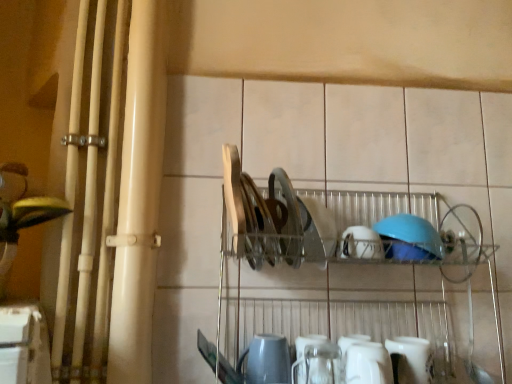
This screenshot has width=512, height=384. Describe the element at coordinates (410, 359) in the screenshot. I see `white glossy mug at lower center, which is the fourth tableware from top to bottom` at that location.

The image size is (512, 384). What do you see at coordinates (368, 364) in the screenshot? I see `white glossy mug at lower center, which is counted as the third tableware, starting from the bottom` at bounding box center [368, 364].

Where is `matte gray kettle at lower center, the third tableware positioned from the top`? Image resolution: width=512 pixels, height=384 pixels. matte gray kettle at lower center, the third tableware positioned from the top is located at coordinates (267, 360).

Is point (411, 381) closer to viewer compared to point (343, 255)?

Yes, it is in front of point (343, 255).

Is white glossy mug at lower center, the 1th tableware viewed from the right, shorter than white matte bowl at center, the 3th tableware viewed from the left?

No, white glossy mug at lower center, the 1th tableware viewed from the right, is not shorter than white matte bowl at center, the 3th tableware viewed from the left.

Considering the relative sizes of white glossy mug at lower center, the 1th tableware viewed from the right, and white matte bowl at center, acting as the 4th tableware starting from the bottom, in the image provided, is white glossy mug at lower center, the 1th tableware viewed from the right, smaller than white matte bowl at center, acting as the 4th tableware starting from the bottom,?

Answer: Actually, white glossy mug at lower center, the 1th tableware viewed from the right, might be larger than white matte bowl at center, acting as the 4th tableware starting from the bottom.

From a real-world perspective, between white glossy mug at lower center, which is the fourth tableware from left to right, and white matte bowl at center, acting as the 4th tableware starting from the bottom, who is vertically higher?

From a 3D spatial view, white matte bowl at center, acting as the 4th tableware starting from the bottom, is above.

From the image's perspective, which is below, metallic silver dish rack at center or white glossy mug at lower center, which is the second tableware in left-to-right order?

white glossy mug at lower center, which is the second tableware in left-to-right order.

Looking at their sizes, would you say metallic silver dish rack at center is wider or thinner than white glossy mug at lower center, the second tableware positioned from the top?

metallic silver dish rack at center is wider than white glossy mug at lower center, the second tableware positioned from the top.

Considering the positions of point (246, 195) and point (392, 382), is point (246, 195) closer or farther from the camera than point (392, 382)?

Clearly, point (246, 195) is closer to the camera than point (392, 382).

Is white glossy mug at lower center, the second tableware positioned from the top, not inside metallic silver dish rack at center?

No, white glossy mug at lower center, the second tableware positioned from the top, is not entirely external to metallic silver dish rack at center.

Between white glossy mug at lower center, the 3th tableware from the right, and metallic silver dish rack at center, which one has smaller size?

white glossy mug at lower center, the 3th tableware from the right, is smaller.

Would you consider white glossy mug at lower center, the 3th tableware from the right, to be distant from metallic silver dish rack at center?

white glossy mug at lower center, the 3th tableware from the right, is actually quite close to metallic silver dish rack at center.

You are a GUI agent. You are given a task and a screenshot of the screen. Output one action in this format:
    pyautogui.click(x=<x>, y=<y>)
    Task: Click on the shelf in front of the white glossy mug at lower center, the second tableware positioned from the top
    This screenshot has height=384, width=512.
    Given the screenshot: What is the action you would take?
    pyautogui.click(x=340, y=262)

Considering the positions of objects metallic silver dish rack at center and white matte bowl at center, acting as the 4th tableware starting from the bottom, in the image provided, who is more to the left, metallic silver dish rack at center or white matte bowl at center, acting as the 4th tableware starting from the bottom,?

metallic silver dish rack at center.

Considering the sizes of objects metallic silver dish rack at center and white matte bowl at center, the second tableware when ordered from right to left, in the image provided, who is shorter, metallic silver dish rack at center or white matte bowl at center, the second tableware when ordered from right to left,?

Standing shorter between the two is white matte bowl at center, the second tableware when ordered from right to left.

Is metallic silver dish rack at center placed right next to white matte bowl at center, the second tableware when ordered from right to left?

No, metallic silver dish rack at center is not making contact with white matte bowl at center, the second tableware when ordered from right to left.

Starting from the metallic silver dish rack at center, which tableware is the 2nd one to the right? Please provide its 2D coordinates.

[(361, 243)]

Is matte gray kettle at lower center, the fourth tableware in the right-to-left sequence, at the right side of metallic silver dish rack at center?

In fact, matte gray kettle at lower center, the fourth tableware in the right-to-left sequence, is to the left of metallic silver dish rack at center.

Relative to metallic silver dish rack at center, is matte gray kettle at lower center, which is the first tableware from left to right, in front or behind?

Visually, matte gray kettle at lower center, which is the first tableware from left to right, is located behind metallic silver dish rack at center.

Is matte gray kettle at lower center, the second tableware when ordered from bottom to top, taller or shorter than metallic silver dish rack at center?

In the image, matte gray kettle at lower center, the second tableware when ordered from bottom to top, appears to be shorter than metallic silver dish rack at center.

Which is correct: white matte bowl at center, which appears as the first tableware when viewed from the top, is inside white glossy mug at lower center, which is counted as the third tableware, starting from the bottom, or outside of it?

white matte bowl at center, which appears as the first tableware when viewed from the top, is not enclosed by white glossy mug at lower center, which is counted as the third tableware, starting from the bottom.

Visually, is white matte bowl at center, acting as the 4th tableware starting from the bottom, positioned to the left or to the right of white glossy mug at lower center, which is counted as the third tableware, starting from the bottom?

white matte bowl at center, acting as the 4th tableware starting from the bottom, is positioned on white glossy mug at lower center, which is counted as the third tableware, starting from the bottom,'s right side.

In the scene shown: From the image's perspective, which one is positioned higher, white matte bowl at center, acting as the 4th tableware starting from the bottom, or white glossy mug at lower center, the 3th tableware from the right?

From the image's view, white matte bowl at center, acting as the 4th tableware starting from the bottom, is above.

Based on the photo, how far apart are white matte bowl at center, the 3th tableware viewed from the left, and white glossy mug at lower center, which is the second tableware in left-to-right order?

They are 7.70 inches apart.

In the scene shown: Considering the relative sizes of white glossy mug at lower center, the 1th tableware viewed from the right, and metallic silver dish rack at center in the image provided, is white glossy mug at lower center, the 1th tableware viewed from the right, bigger than metallic silver dish rack at center?

No, white glossy mug at lower center, the 1th tableware viewed from the right, is not bigger than metallic silver dish rack at center.

From a real-world perspective, between white glossy mug at lower center, the first tableware in the bottom-to-top sequence, and metallic silver dish rack at center, who is vertically higher?

metallic silver dish rack at center, from a real-world perspective.

Between white glossy mug at lower center, the first tableware in the bottom-to-top sequence, and metallic silver dish rack at center, which one appears on the left side from the viewer's perspective?

Positioned to the left is metallic silver dish rack at center.

Locate an element on the screen. tableware that appears on the right of white matte bowl at center, which appears as the first tableware when viewed from the top is located at coordinates (410, 359).

At what (x,y) coordinates should I click in order to perform the action: click on shelf located above the white glossy mug at lower center, which is the second tableware in left-to-right order (from the image's perspective). Please return your answer as a coordinate pair (x, y). The image size is (512, 384). Looking at the image, I should click on (340, 262).

Which object lies further to the anchor point matte gray kettle at lower center, the second tableware when ordered from bottom to top, white matte bowl at center, acting as the 4th tableware starting from the bottom, or white glossy mug at lower center, which is the fourth tableware from left to right?

The object further to matte gray kettle at lower center, the second tableware when ordered from bottom to top, is white matte bowl at center, acting as the 4th tableware starting from the bottom.

Based on the photo, based on their spatial positions, is white matte bowl at center, acting as the 4th tableware starting from the bottom, or white glossy mug at lower center, which is the fourth tableware from left to right, closer to white glossy mug at lower center, the 3th tableware from the right?

The object closer to white glossy mug at lower center, the 3th tableware from the right, is white glossy mug at lower center, which is the fourth tableware from left to right.

When comparing their distances from white glossy mug at lower center, the first tableware in the bottom-to-top sequence, does metallic silver dish rack at center or matte gray kettle at lower center, the second tableware when ordered from bottom to top, seem further?

matte gray kettle at lower center, the second tableware when ordered from bottom to top, lies further to white glossy mug at lower center, the first tableware in the bottom-to-top sequence, than the other object.

Considering their positions, is white glossy mug at lower center, the first tableware in the bottom-to-top sequence, positioned closer to white matte bowl at center, which appears as the first tableware when viewed from the top, than white glossy mug at lower center, the second tableware positioned from the top?

white glossy mug at lower center, the second tableware positioned from the top, is closer to white matte bowl at center, which appears as the first tableware when viewed from the top.

Considering their positions, is white glossy mug at lower center, the first tableware in the bottom-to-top sequence, positioned further to metallic silver dish rack at center than white matte bowl at center, acting as the 4th tableware starting from the bottom?

white glossy mug at lower center, the first tableware in the bottom-to-top sequence, is further to metallic silver dish rack at center.

Considering their positions, is matte gray kettle at lower center, the second tableware when ordered from bottom to top, positioned closer to metallic silver dish rack at center than white matte bowl at center, which appears as the first tableware when viewed from the top?

Among the two, white matte bowl at center, which appears as the first tableware when viewed from the top, is located nearer to metallic silver dish rack at center.

Looking at the image, which one is located further to matte gray kettle at lower center, the second tableware when ordered from bottom to top, white glossy mug at lower center, which is the fourth tableware from left to right, or white matte bowl at center, which appears as the first tableware when viewed from the top?

Among the two, white matte bowl at center, which appears as the first tableware when viewed from the top, is located further to matte gray kettle at lower center, the second tableware when ordered from bottom to top.

Looking at this image, considering their positions, is metallic silver dish rack at center positioned further to matte gray kettle at lower center, which is the first tableware from left to right, than white glossy mug at lower center, which is the fourth tableware from left to right?

Based on the image, metallic silver dish rack at center appears to be further to matte gray kettle at lower center, which is the first tableware from left to right.

Find the location of a particular element. Image resolution: width=512 pixels, height=384 pixels. shelf between white matte bowl at center, the 3th tableware viewed from the left, and matte gray kettle at lower center, the third tableware positioned from the top, in the vertical direction is located at coordinates (340, 262).

Image resolution: width=512 pixels, height=384 pixels. In order to click on shelf between white matte bowl at center, acting as the 4th tableware starting from the bottom, and white glossy mug at lower center, which is the fourth tableware from left to right, in the up-down direction in this screenshot , I will do `click(340, 262)`.

I want to click on shelf situated between matte gray kettle at lower center, the third tableware positioned from the top, and white glossy mug at lower center, which is the fourth tableware from left to right, from left to right, so click(x=340, y=262).

This screenshot has width=512, height=384. I want to click on shelf between white matte bowl at center, acting as the 4th tableware starting from the bottom, and white glossy mug at lower center, the second tableware positioned from the top, in the vertical direction, so click(340, 262).